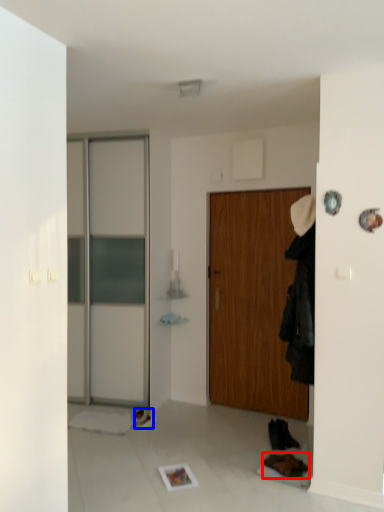
Question: Which object is closer to the camera taking this photo, shoe (highlighted by a red box) or shoe (highlighted by a blue box)?

Choices:
 (A) shoe
 (B) shoe

Answer: (A)